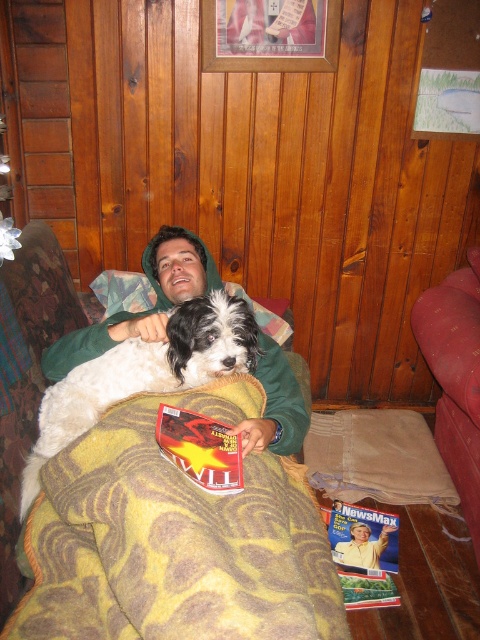
Question: Is yellow fleece blanket at center positioned behind green fleece hoodie at center?

Choices:
 (A) yes
 (B) no

Answer: (B)

Question: Which of the following is the closest to the observer?

Choices:
 (A) (469, 294)
 (B) (175, 369)
 (C) (153, 268)
 (D) (239, 529)

Answer: (D)

Question: Which object is positioned closest to the green fleece hoodie at center?

Choices:
 (A) white fluffy dog at upper center
 (B) yellow fleece blanket at center
 (C) velvet maroon couch at lower right

Answer: (A)

Question: Is white fluffy dog at upper center positioned behind velvet maroon couch at lower right?

Choices:
 (A) no
 (B) yes

Answer: (A)

Question: Can you confirm if white fluffy dog at upper center is smaller than green fleece hoodie at center?

Choices:
 (A) no
 (B) yes

Answer: (B)

Question: Which object is the closest to the white fluffy dog at upper center?

Choices:
 (A) velvet maroon couch at lower right
 (B) yellow fleece blanket at center

Answer: (B)